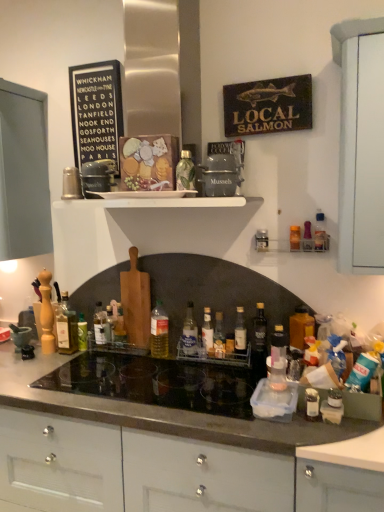
Question: Does translucent glass bottle at center, which is the eighth bottle in left-to-right order, appear on the left side of translucent glass bottle at left, the 1th bottle in the left-to-right sequence?

Choices:
 (A) no
 (B) yes

Answer: (A)

Question: Are translucent glass bottle at center, which is the eighth bottle in left-to-right order, and translucent glass bottle at left, the 1th bottle in the left-to-right sequence, beside each other?

Choices:
 (A) no
 (B) yes

Answer: (A)

Question: Can you confirm if translucent glass bottle at center, which is the eighth bottle in left-to-right order, is wider than translucent glass bottle at left, the 1th bottle in the left-to-right sequence?

Choices:
 (A) yes
 (B) no

Answer: (B)

Question: From a real-world perspective, is translucent glass bottle at center, which is the eighth bottle in left-to-right order, positioned over translucent glass bottle at left, which is the 12th bottle from right to left, based on gravity?

Choices:
 (A) no
 (B) yes

Answer: (A)

Question: Is translucent glass bottle at center, which is the fifth bottle from right to left, located outside translucent glass bottle at left, the 1th bottle in the left-to-right sequence?

Choices:
 (A) yes
 (B) no

Answer: (A)

Question: Looking at their shapes, would you say translucent plastic bottle at center, arranged as the 9th bottle when viewed from the right, is wider or thinner than translucent plastic bottle at center, which appears as the second bottle when viewed from the right?

Choices:
 (A) wide
 (B) thin

Answer: (A)

Question: Is translucent plastic bottle at center, arranged as the 9th bottle when viewed from the right, spatially inside translucent plastic bottle at center, placed as the eleventh bottle when sorted from left to right, or outside of it?

Choices:
 (A) outside
 (B) inside

Answer: (A)

Question: In the image, is translucent plastic bottle at center, arranged as the 9th bottle when viewed from the right, on the left side or the right side of translucent plastic bottle at center, placed as the eleventh bottle when sorted from left to right?

Choices:
 (A) left
 (B) right

Answer: (A)

Question: Is translucent plastic bottle at center, arranged as the 9th bottle when viewed from the right, in front of or behind translucent plastic bottle at center, placed as the eleventh bottle when sorted from left to right, in the image?

Choices:
 (A) front
 (B) behind

Answer: (B)

Question: From their relative heights in the image, would you say translucent glass bottle at center, which is the eighth bottle in left-to-right order, is taller or shorter than translucent glass bottle at left, the 1th bottle in the left-to-right sequence?

Choices:
 (A) short
 (B) tall

Answer: (A)

Question: In the image, is translucent glass bottle at center, which is the fifth bottle from right to left, positioned in front of or behind translucent glass bottle at left, which is the 12th bottle from right to left?

Choices:
 (A) front
 (B) behind

Answer: (A)

Question: In terms of size, does translucent glass bottle at center, which is the fifth bottle from right to left, appear bigger or smaller than translucent glass bottle at left, the 1th bottle in the left-to-right sequence?

Choices:
 (A) big
 (B) small

Answer: (B)

Question: Considering the positions of point (218, 324) and point (76, 330), is point (218, 324) closer or farther from the camera than point (76, 330)?

Choices:
 (A) farther
 (B) closer

Answer: (B)

Question: Considering the relative positions of white glossy shelf at upper center and clear glass bottle at center, which is the sixth bottle from right to left, in the image provided, is white glossy shelf at upper center to the left or to the right of clear glass bottle at center, which is the sixth bottle from right to left,?

Choices:
 (A) right
 (B) left

Answer: (B)

Question: Looking at the image, does white glossy shelf at upper center seem bigger or smaller compared to clear glass bottle at center, placed as the 7th bottle when sorted from left to right?

Choices:
 (A) small
 (B) big

Answer: (B)